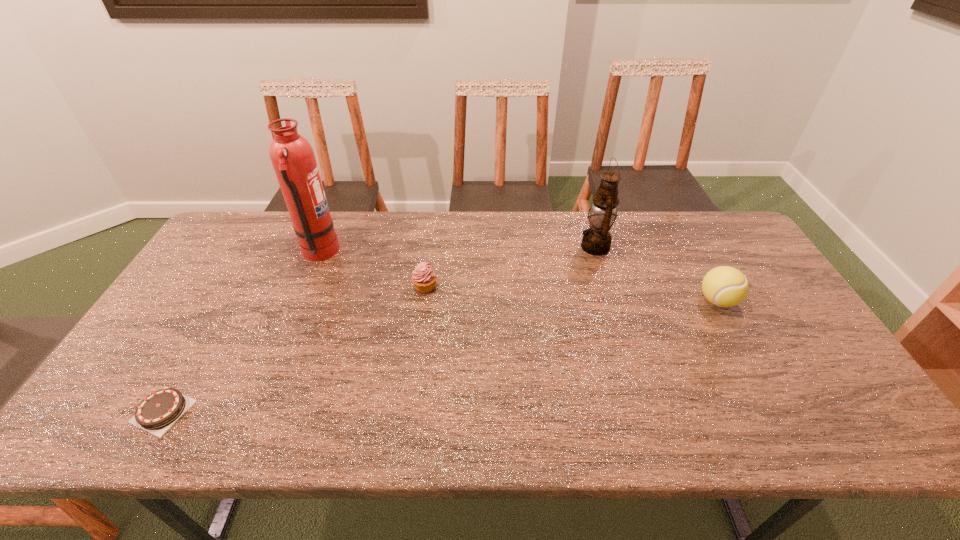
In order to click on empty location between the tennis ball and the third object from left to right in this screenshot , I will do `click(571, 294)`.

The height and width of the screenshot is (540, 960). In order to click on free space between the oil lamp and the second shortest object in this screenshot , I will do `click(510, 267)`.

I want to click on free point between the fire extinguisher and the oil lamp, so click(457, 249).

What are the coordinates of `free space between the rightmost object and the oil lamp` in the screenshot? It's located at (656, 274).

Find the location of a particular element. vacant area between the fourth tallest object and the oil lamp is located at coordinates (510, 267).

At what (x,y) coordinates should I click in order to perform the action: click on vacant area that lies between the leftmost object and the fourth tallest object. Please return your answer as a coordinate pair (x, y). Looking at the image, I should click on (294, 349).

At what (x,y) coordinates should I click in order to perform the action: click on free spot between the second shortest object and the leftmost object. Please return your answer as a coordinate pair (x, y). This screenshot has height=540, width=960. Looking at the image, I should click on (294, 349).

You are a GUI agent. You are given a task and a screenshot of the screen. Output one action in this format:
    pyautogui.click(x=<x>, y=<y>)
    Task: Click on the object that is the second closest one to the leftmost object
    The image size is (960, 540).
    Given the screenshot: What is the action you would take?
    pyautogui.click(x=424, y=278)

Select which object appears as the fourth closest to the fourth shortest object. Please provide its 2D coordinates. Your answer should be formatted as a tuple, i.e. [(x, y)], where the tuple contains the x and y coordinates of a point satisfying the conditions above.

[(156, 413)]

Image resolution: width=960 pixels, height=540 pixels. Find the location of `vacant space that satisfies the following two spatial constraints: 1. on the label side of the tallest object; 2. on the left side of the tennis ball`. vacant space that satisfies the following two spatial constraints: 1. on the label side of the tallest object; 2. on the left side of the tennis ball is located at coordinates (300, 301).